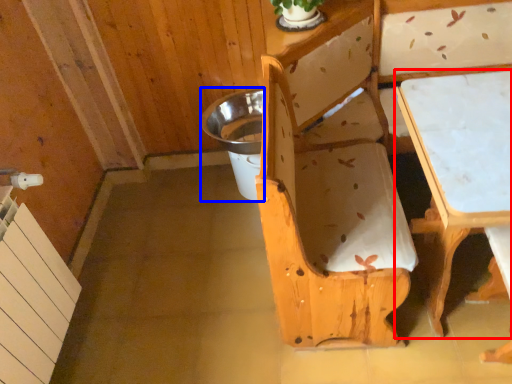
Question: Among these objects, which one is nearest to the camera, table (highlighted by a red box) or potty (highlighted by a blue box)?

Choices:
 (A) table
 (B) potty

Answer: (A)